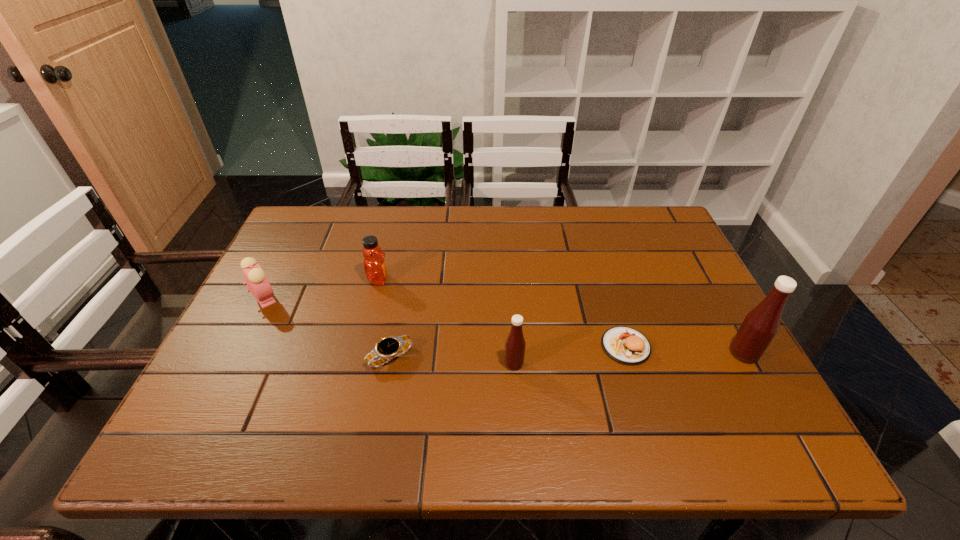
What are the coordinates of `free spot at the left edge of the desktop` in the screenshot? It's located at (226, 340).

You are a GUI agent. You are given a task and a screenshot of the screen. Output one action in this format:
    pyautogui.click(x=<x>, y=<y>)
    Task: Click on the free space at the right edge
    
    Given the screenshot: What is the action you would take?
    pyautogui.click(x=695, y=284)

Identify the location of vacant space at the far left corner of the desktop. (285, 247).

This screenshot has height=540, width=960. In order to click on free space at the far right corner of the desktop in this screenshot , I will do `click(681, 246)`.

Where is `free space between the fifth object from left to right and the shorter Tabasco sauce`? This screenshot has height=540, width=960. free space between the fifth object from left to right and the shorter Tabasco sauce is located at coordinates (569, 355).

Image resolution: width=960 pixels, height=540 pixels. In order to click on free space between the second shortest object and the honey in this screenshot , I will do `click(502, 313)`.

Locate an element on the screen. The width and height of the screenshot is (960, 540). free space between the honey and the second object from right to left is located at coordinates 502,313.

Where is `free space between the watch and the tallest object`? The height and width of the screenshot is (540, 960). free space between the watch and the tallest object is located at coordinates (567, 355).

Locate an element on the screen. The width and height of the screenshot is (960, 540). empty location between the patty and the alarm clock is located at coordinates (445, 322).

What are the coordinates of `free space between the tallest object and the watch` in the screenshot? It's located at (567, 355).